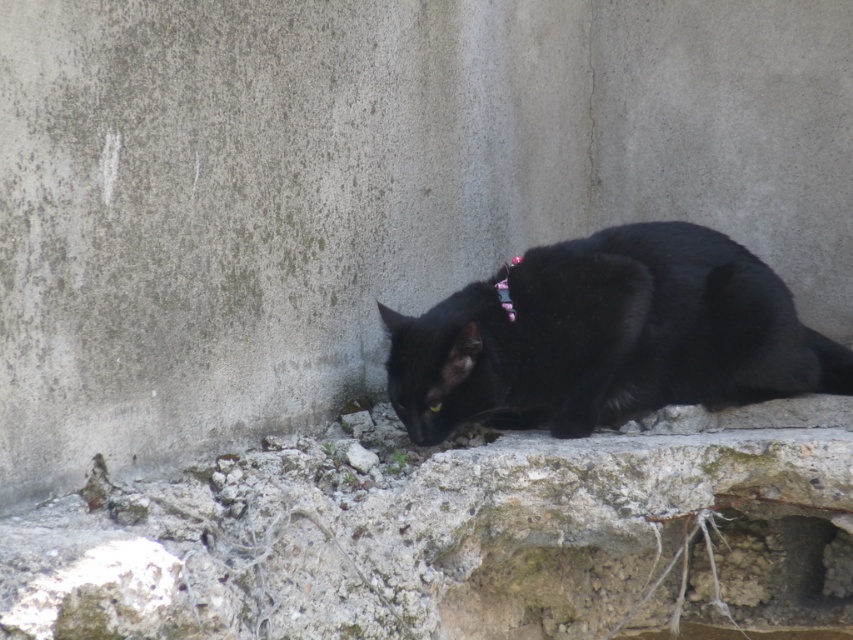
You are a photographer trying to capture a closeup of the black fur cat at lower right and the pink fabric neckband at center. Your camera can focus on objects within a 10 inch range. Can you take a photo that includes both objects in focus without moving the camera?

The distance between the black fur cat at lower right and the pink fabric neckband at center is 9.97 inches, which is within the camera focus range of 10 inches. Therefore, you can take a photo that includes both objects in focus without moving the camera.

Based on the photo, you are a painter who needs to paint the rough concrete wall at lower center. You have a ladder that can extend up to 1.6 meters. Can you safely reach the top of the wall without needing a taller ladder?

The rough concrete wall at lower center and viewer are 1.74 meters apart. Since the ladder can only extend to 1.6 meters, it is not tall enough to safely reach the top of the wall. You would need a taller ladder.